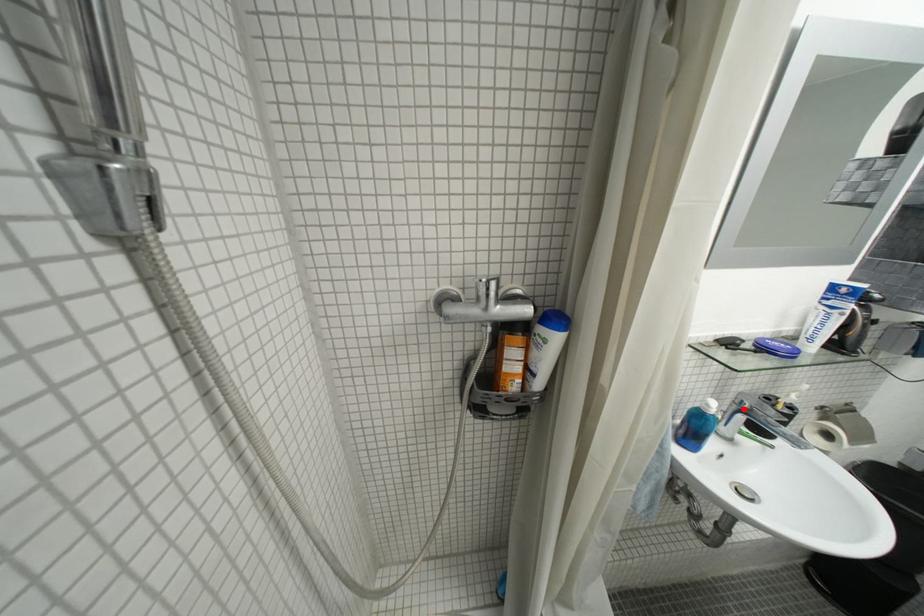
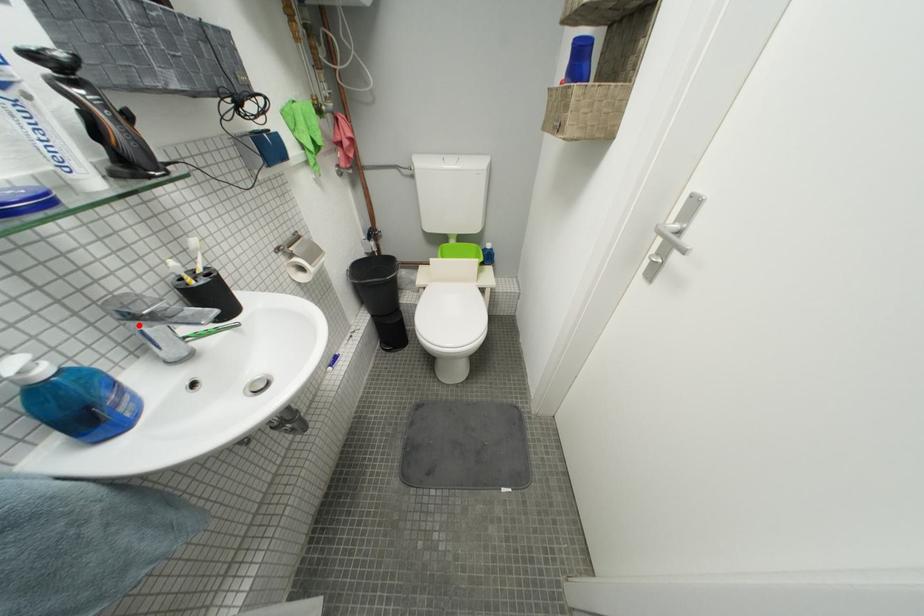
I am providing you with two images of the same scene from different viewpoints. A red point is marked on the first image and another point is marked on the second image. Does the point marked in image1 correspond to the same location as the one in image2?

Yes